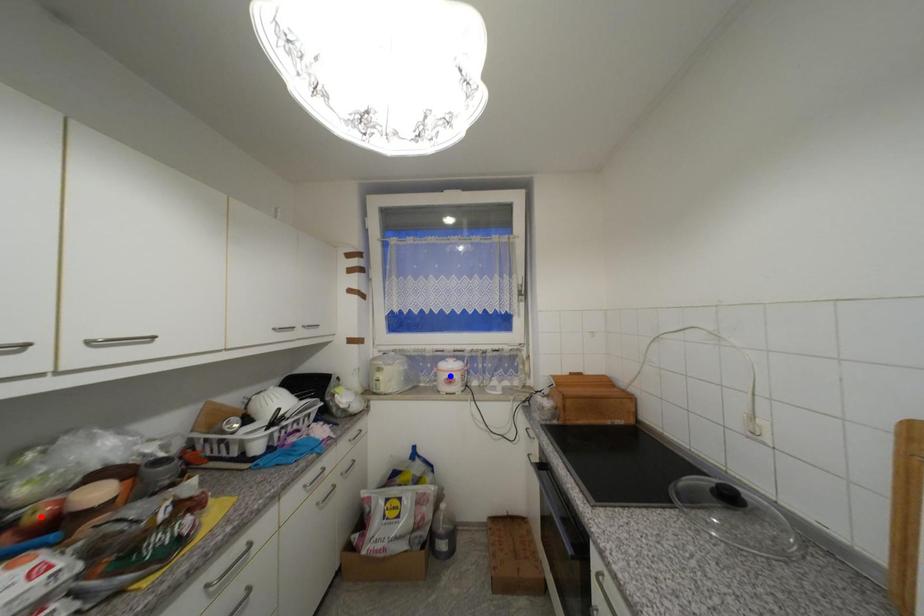
Question: Two points are marked on the image. Which point is closer to the camera?

Choices:
 (A) Blue point is closer.
 (B) Red point is closer.

Answer: (B)